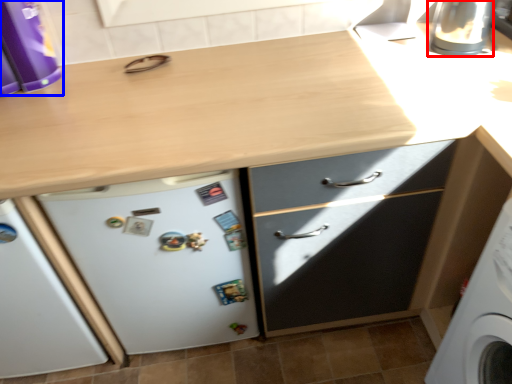
Question: Which of the following is the closest to the observer, appliance (highlighted by a red box) or kitchen appliance (highlighted by a blue box)?

Choices:
 (A) appliance
 (B) kitchen appliance

Answer: (B)